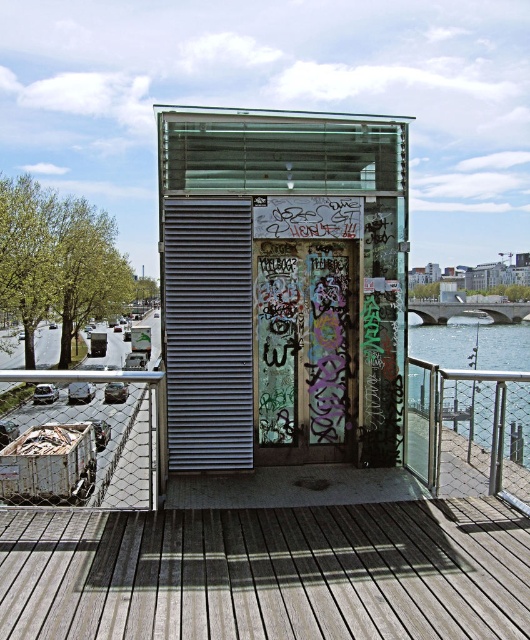
Question: Considering the real-world distances, which object is closest to the metallic glass bus stop at center?

Choices:
 (A) clear water at lower right
 (B) rusty metal shipping container at lower left
 (C) wooden planks at center

Answer: (C)

Question: Is wooden planks at center to the left of rusty metal shipping container at lower left from the viewer's perspective?

Choices:
 (A) yes
 (B) no

Answer: (B)

Question: Is metallic glass bus stop at center above rusty metal shipping container at lower left?

Choices:
 (A) yes
 (B) no

Answer: (A)

Question: Which of the following is the farthest from the observer?

Choices:
 (A) (266, 627)
 (B) (94, 445)
 (C) (363, 362)

Answer: (B)

Question: Is wooden planks at center closer to the viewer compared to clear water at lower right?

Choices:
 (A) no
 (B) yes

Answer: (B)

Question: Which of the following is the closest to the observer?

Choices:
 (A) (170, 536)
 (B) (72, 464)

Answer: (A)